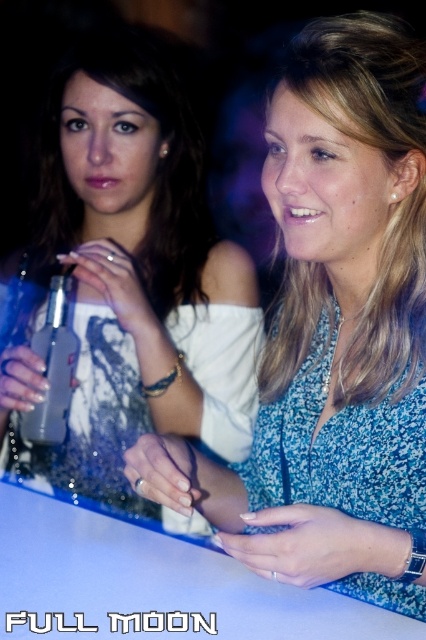
Is point (322, 40) in front of point (5, 419)?

Yes, point (322, 40) is closer to viewer.

Can you confirm if matte white dress at center is positioned above matte black dress at upper left?

Incorrect, matte white dress at center is not positioned above matte black dress at upper left.

Which is in front, point (414, 400) or point (161, 284)?

Point (414, 400) is in front.

The width and height of the screenshot is (426, 640). What are the coordinates of `matte white dress at center` in the screenshot? It's located at (333, 333).

Does matte white dress at center have a lesser width compared to clear glass bottle at center?

Incorrect, matte white dress at center's width is not less than clear glass bottle at center's.

This screenshot has height=640, width=426. Describe the element at coordinates (333, 333) in the screenshot. I see `matte white dress at center` at that location.

The height and width of the screenshot is (640, 426). In order to click on matte white dress at center in this screenshot , I will do `click(333, 333)`.

Does matte black dress at upper left have a lesser height compared to clear glass bottle at center?

In fact, matte black dress at upper left may be taller than clear glass bottle at center.

Is the position of matte black dress at upper left more distant than that of clear glass bottle at center?

No, matte black dress at upper left is closer to the viewer.

Where is `matte black dress at upper left`? matte black dress at upper left is located at coordinates (132, 282).